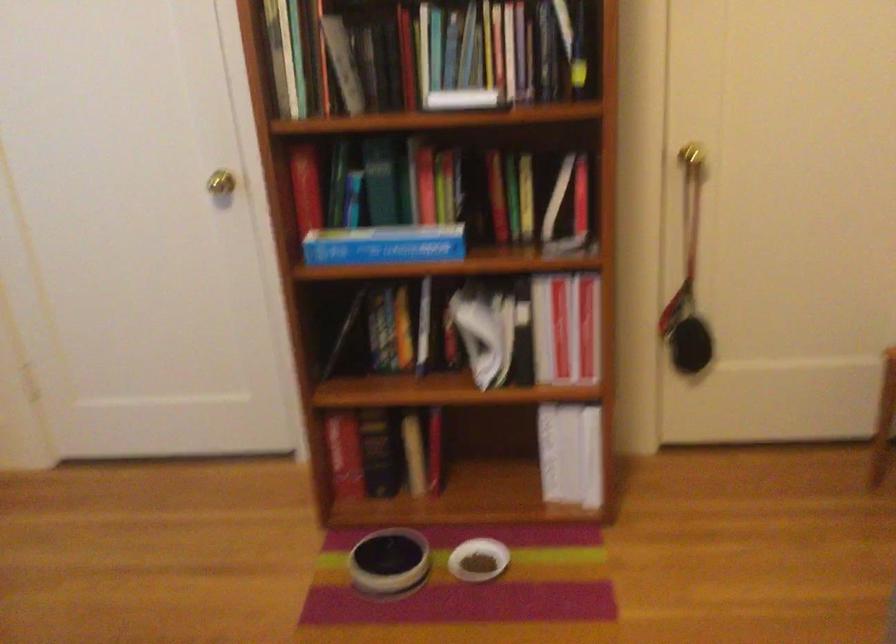
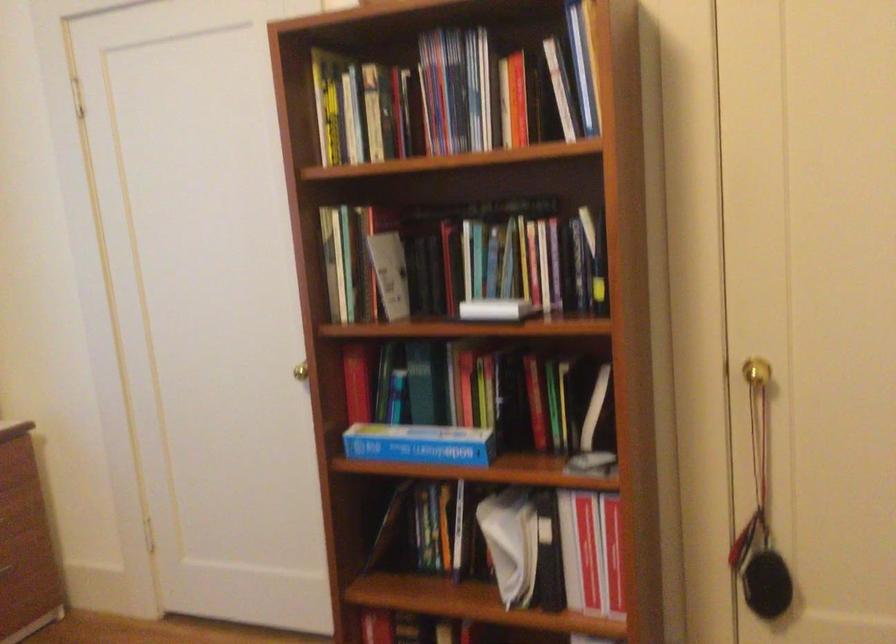
In the second image, find the point that corresponds to point (584, 330) in the first image.

(613, 554)